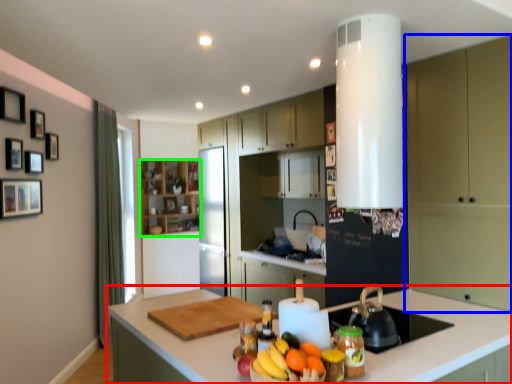
Question: Estimate the real-world distances between objects in this image. Which object is closer to countertop (highlighted by a red box), cabinetry (highlighted by a blue box) or cabinetry (highlighted by a green box)?

Choices:
 (A) cabinetry
 (B) cabinetry

Answer: (A)